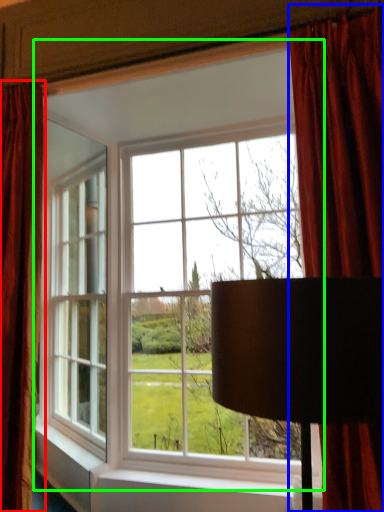
Question: Which is nearer to the curtain (highlighted by a red box)? curtain (highlighted by a blue box) or window (highlighted by a green box).

Choices:
 (A) curtain
 (B) window

Answer: (B)